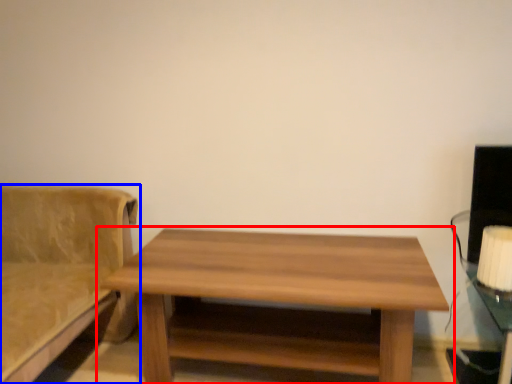
Question: Among these objects, which one is nearest to the camera, table (highlighted by a red box) or studio couch (highlighted by a blue box)?

Choices:
 (A) table
 (B) studio couch

Answer: (B)